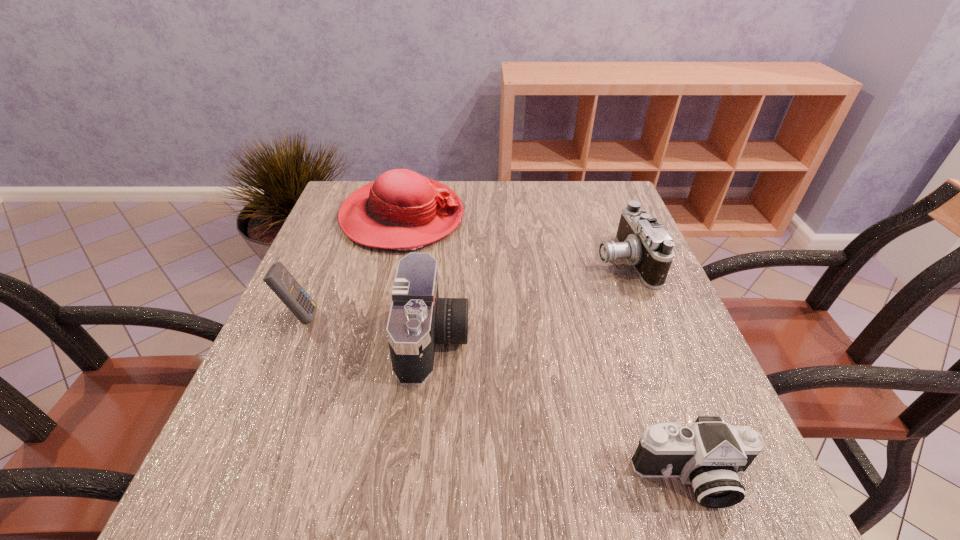
I want to click on free space that satisfies the following two spatial constraints: 1. on the front-facing side of the nearest object; 2. on the left side of the leftmost camera, so click(420, 478).

The image size is (960, 540). I want to click on free space that satisfies the following two spatial constraints: 1. on the front-facing side of the nearest camera; 2. on the left side of the calculator, so click(x=231, y=478).